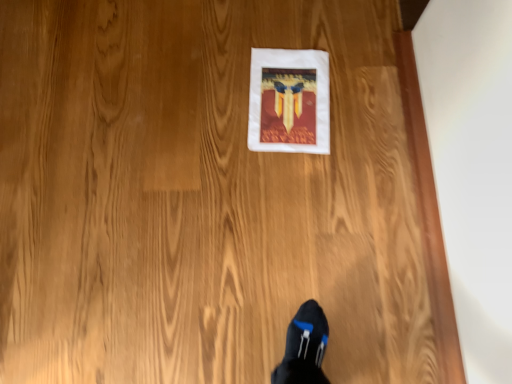
This screenshot has width=512, height=384. In order to click on vacant space that is to the left of matte paper comic book at center in this screenshot , I will do `click(194, 96)`.